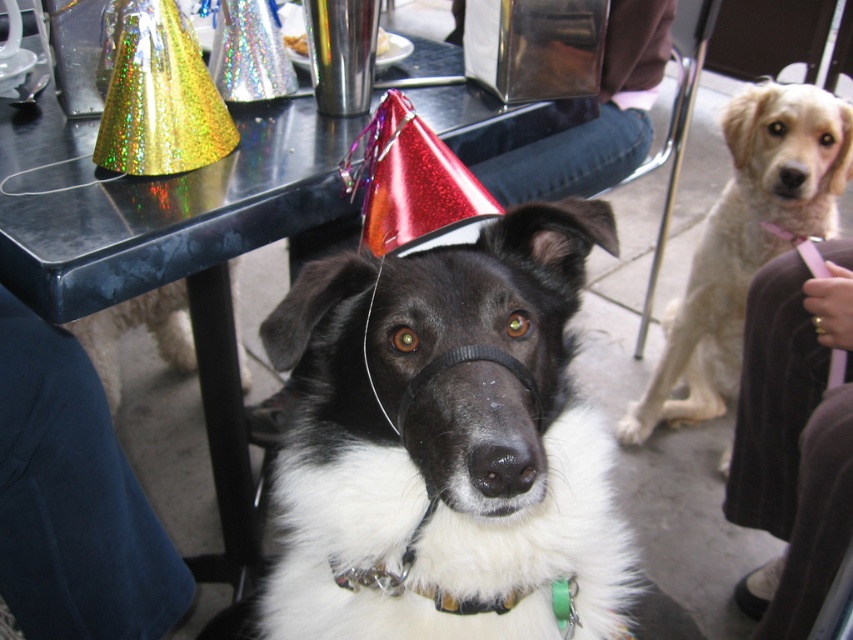
Can you confirm if brown wool pants at lower right is taller than metallic napkin holder at center?

Correct, brown wool pants at lower right is much taller as metallic napkin holder at center.

Where is `brown wool pants at lower right`? The height and width of the screenshot is (640, 853). brown wool pants at lower right is located at coordinates (793, 436).

Does point (810, 298) lie in front of point (666, 28)?

Yes, point (810, 298) is in front of point (666, 28).

Where is `brown wool pants at lower right`? Image resolution: width=853 pixels, height=640 pixels. brown wool pants at lower right is located at coordinates [x=793, y=436].

Which is in front, point (366, 442) or point (692, 337)?

Positioned in front is point (366, 442).

Is white fur dog at center further to the viewer compared to light beige fur at right?

No, white fur dog at center is closer to the viewer.

At what (x,y) coordinates should I click in order to perform the action: click on white fur dog at center. Please return your answer as a coordinate pair (x, y). Looking at the image, I should click on (447, 444).

Measure the distance between point [170,177] and camera.

Point [170,177] and camera are 1.02 meters apart from each other.

Does metallic reflective table at center have a greater width compared to metallic napkin holder at center?

Indeed, metallic reflective table at center has a greater width compared to metallic napkin holder at center.

This screenshot has height=640, width=853. Identify the location of metallic reflective table at center. (189, 259).

The width and height of the screenshot is (853, 640). I want to click on metallic reflective table at center, so click(189, 259).